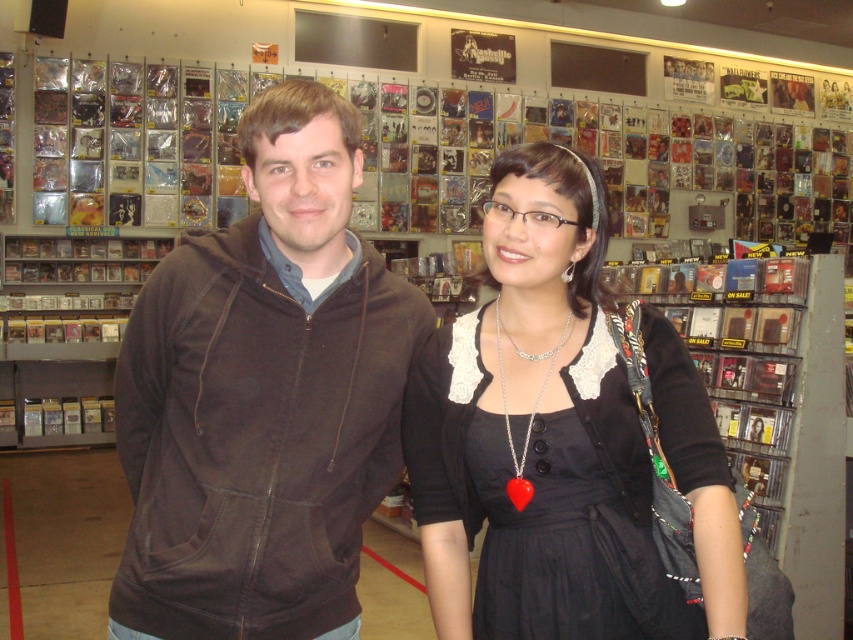
Who is higher up, brown cotton hoodie at left or black lace dress at center?

brown cotton hoodie at left

Between brown cotton hoodie at left and black lace dress at center, which one has less height?

Standing shorter between the two is black lace dress at center.

What do you see at coordinates (263, 396) in the screenshot? I see `brown cotton hoodie at left` at bounding box center [263, 396].

Where is `brown cotton hoodie at left`? Image resolution: width=853 pixels, height=640 pixels. brown cotton hoodie at left is located at coordinates (263, 396).